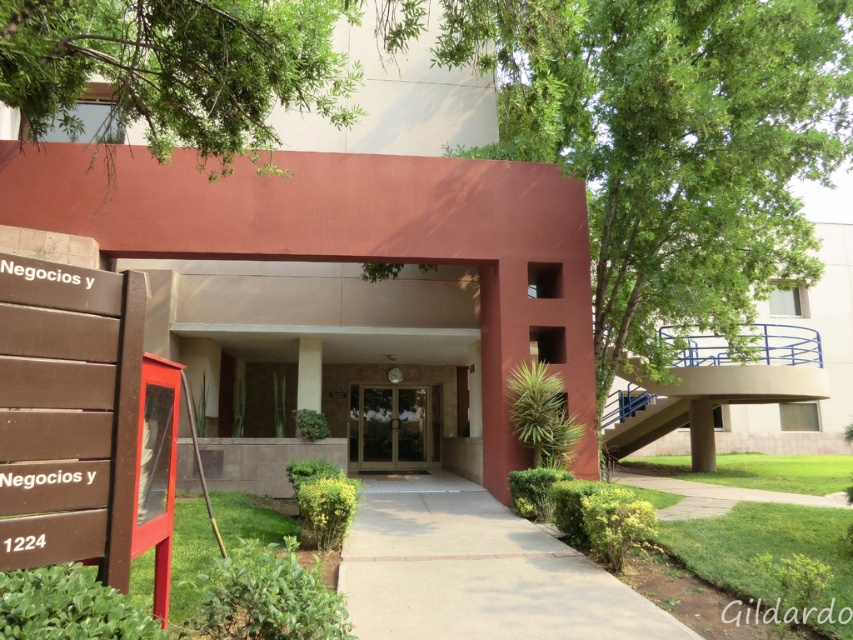
Question: Is green leafy tree at upper left closer to the viewer compared to concrete at center?

Choices:
 (A) yes
 (B) no

Answer: (A)

Question: Is green leafy tree at upper left wider than brown glass doors at center?

Choices:
 (A) yes
 (B) no

Answer: (A)

Question: Among these points, which one is nearest to the camera?

Choices:
 (A) (387, 392)
 (B) (451, 493)

Answer: (B)

Question: Is green leafy tree at upper left behind concrete at center?

Choices:
 (A) yes
 (B) no

Answer: (B)

Question: Among these points, which one is nearest to the camera?

Choices:
 (A) (38, 83)
 (B) (448, 563)

Answer: (A)

Question: Which point is closer to the camera?

Choices:
 (A) (428, 465)
 (B) (469, 572)

Answer: (B)